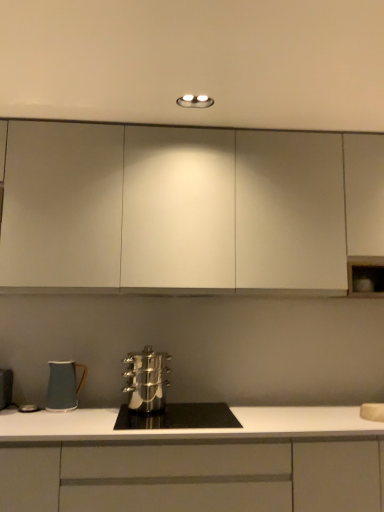
Question: Is point (382, 159) closer or farther from the camera than point (51, 364)?

Choices:
 (A) closer
 (B) farther

Answer: (A)

Question: From the image's perspective, is white matte cabinet at upper center, the first cabinetry in the top-to-bottom sequence, located above or below matte ceramic mug at lower left, the second kitchen appliance positioned from the right?

Choices:
 (A) above
 (B) below

Answer: (A)

Question: Based on their relative distances, which object is nearer to the stainless steel cookware at center?

Choices:
 (A) stainless steel steamer at center, the 2th kitchen appliance viewed from the left
 (B) matte ceramic mug at lower left, the second kitchen appliance positioned from the right
 (C) white matte cabinet at center, which is the first cabinetry in bottom-to-top order
 (D) white matte sink at lower right
 (E) white matte cabinet at upper center, the second cabinetry in the bottom-to-top sequence

Answer: (A)

Question: Estimate the real-world distances between objects in this image. Which object is closer to the stainless steel cookware at center?

Choices:
 (A) stainless steel steamer at center, the 2th kitchen appliance viewed from the left
 (B) matte ceramic mug at lower left, the second kitchen appliance positioned from the right
 (C) white matte sink at lower right
 (D) white matte cabinet at center, which is the first cabinetry in bottom-to-top order
 (E) white matte cabinet at upper center, the second cabinetry in the bottom-to-top sequence

Answer: (A)